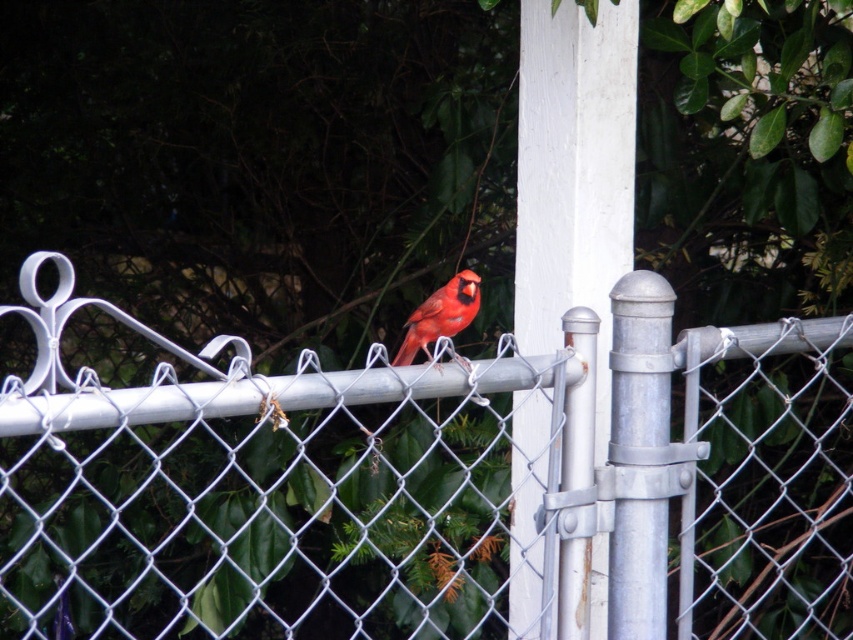
Can you confirm if metallic silver fence at center is positioned above white metallic pole at center?

Actually, metallic silver fence at center is below white metallic pole at center.

How much distance is there between metallic silver fence at center and white metallic pole at center?

metallic silver fence at center is 19.87 inches from white metallic pole at center.

Identify the location of metallic silver fence at center. (433, 486).

Who is shorter, galvanized metal post at center-right or matte red cardinal at center?

Standing shorter between the two is matte red cardinal at center.

Who is more forward, (616, 292) or (431, 314)?

Point (616, 292) is in front.

Is point (625, 412) less distant than point (467, 301)?

Yes, it is in front of point (467, 301).

I want to click on galvanized metal post at center-right, so click(x=640, y=358).

Is white metallic pole at center closer to the viewer compared to galvanized metal post at center-right?

Yes.

Which of these two, white metallic pole at center or galvanized metal post at center-right, stands shorter?

galvanized metal post at center-right

Is point (569, 260) behind point (634, 593)?

That is True.

You are a GUI agent. You are given a task and a screenshot of the screen. Output one action in this format:
    pyautogui.click(x=<x>, y=<y>)
    Task: Click on the white metallic pole at center
    This screenshot has width=853, height=640.
    Given the screenshot: What is the action you would take?
    point(573,173)